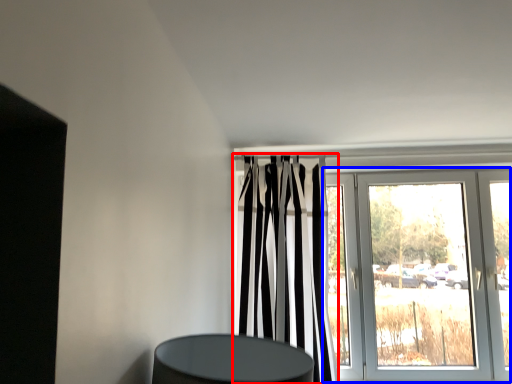
Question: Among these objects, which one is nearest to the camera, curtain (highlighted by a red box) or door (highlighted by a blue box)?

Choices:
 (A) curtain
 (B) door

Answer: (A)